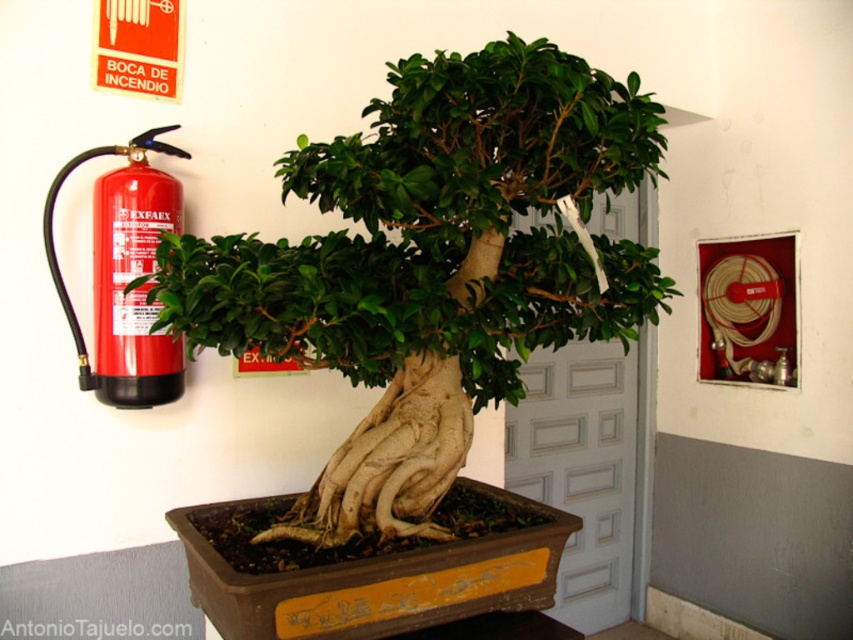
Can you confirm if green matte bonsai tree at center is wider than red matte fire extinguisher at left?

Yes, green matte bonsai tree at center is wider than red matte fire extinguisher at left.

Find the location of a particular element. green matte bonsai tree at center is located at coordinates (432, 266).

Locate an element on the screen. green matte bonsai tree at center is located at coordinates (432, 266).